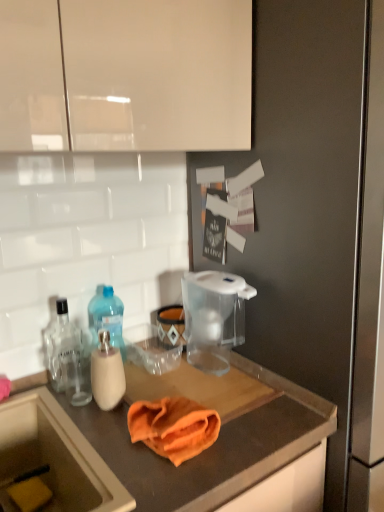
Identify the location of free point in front of transparent plastic water filter pitcher at center. (226, 397).